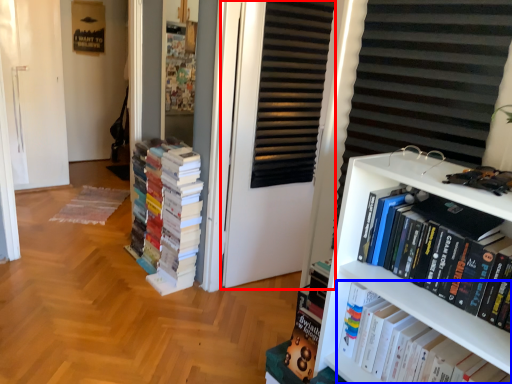
Question: Which object appears closest to the camera in this image, screen door (highlighted by a red box) or book (highlighted by a blue box)?

Choices:
 (A) screen door
 (B) book

Answer: (B)